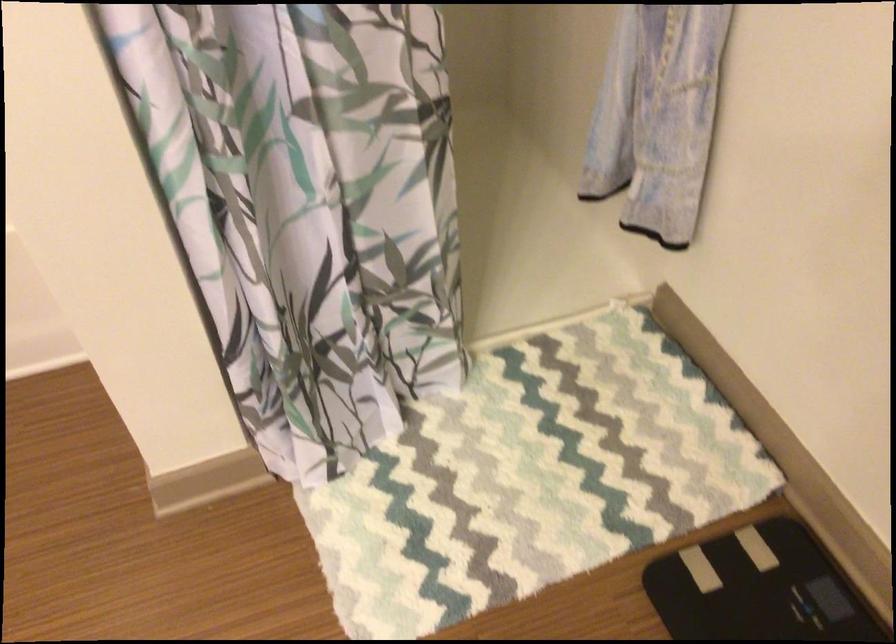
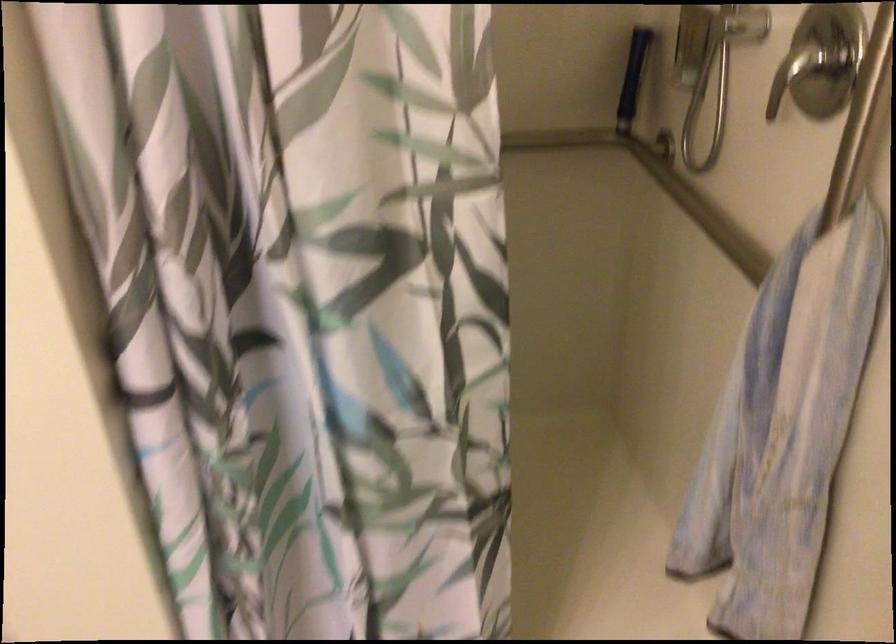
Question: The first image is from the beginning of the video and the second image is from the end. How did the camera likely rotate when shooting the video?

Choices:
 (A) Left
 (B) Right
 (C) Up
 (D) Down

Answer: (C)